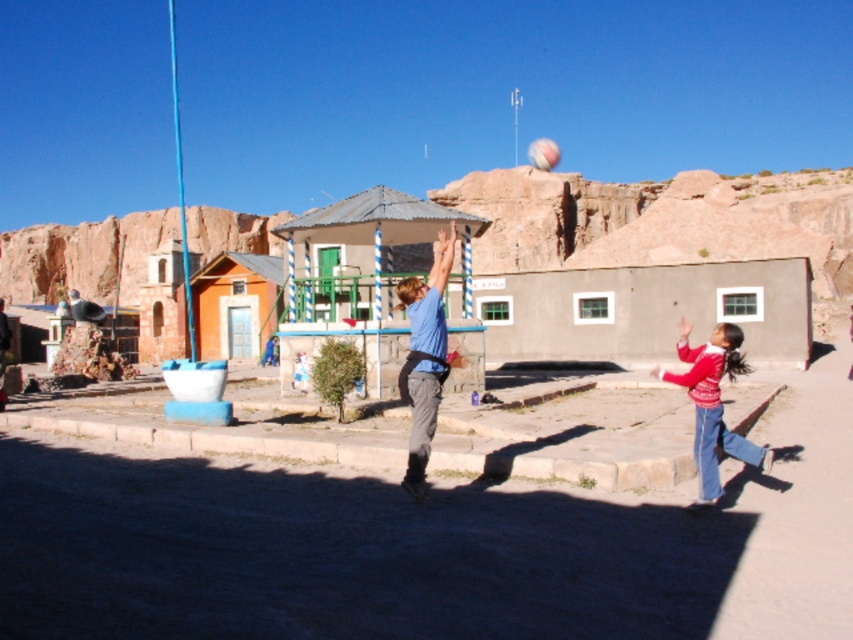
Does blue matte shirt at center have a greater width compared to red sweater at lower right?

Incorrect, blue matte shirt at center's width does not surpass red sweater at lower right's.

What do you see at coordinates (424, 358) in the screenshot? I see `blue matte shirt at center` at bounding box center [424, 358].

At what (x,y) coordinates should I click in order to perform the action: click on blue matte shirt at center. Please return your answer as a coordinate pair (x, y). Looking at the image, I should click on pyautogui.click(x=424, y=358).